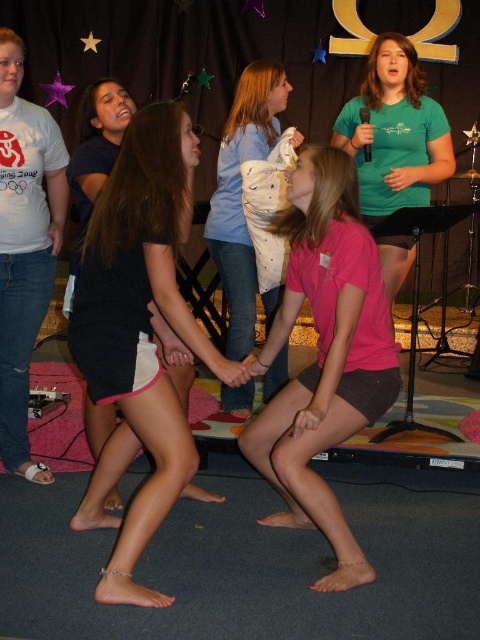
You are a photographer trying to capture a clear shot of both the white fabric shorts at center and the pink matte shorts at center. Which pair of shorts will be more visible in your photo due to their positioning?

The white fabric shorts at center will be more visible in the photo because it is positioned in front of the pink matte shorts at center, making it appear closer to the camera.

You are a photographer trying to capture a clear shot of both the pink matte shorts at center and the white dotted shirt at center. Since you can only focus on one object at a time, which one should you choose to ensure the other is still somewhat in focus?

The pink matte shorts at center is closer to the viewer than the white dotted shirt at center. To ensure the other is somewhat in focus, you should focus on the white dotted shirt at center because it is farther away, as depth of field typically extends further behind the point of focus than in front.

Based on the photo, you are a photographer standing at the back of the room. You want to capture a photo of both the white fabric shorts at center and the pink matte shorts at center in the same frame. Considering the distance between them, do you think you can fit both into your camera viewfinder without moving closer or farther?

The white fabric shorts at center is 17.10 inches away from the pink matte shorts at center. Since the distance between them is relatively small, you can likely fit both into your camera viewfinder without needing to adjust your position.